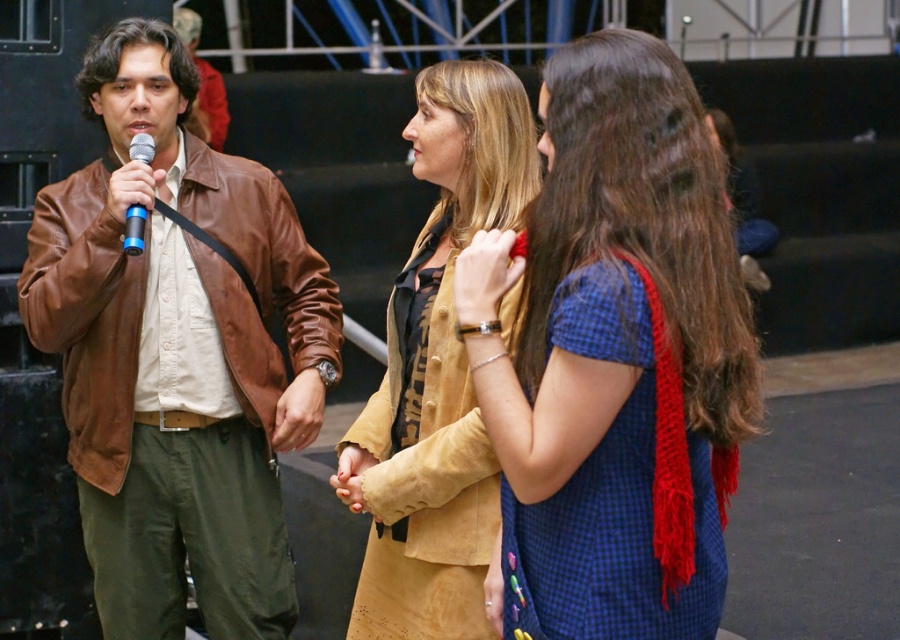
From the picture: You are a photographer who needs to capture a photo of the two jackets, brown leather jacket at left and suede jacket at center, ensuring they are both in focus. Given that your camera can only keep objects within 80 centimeters of each other in focus, will you be able to achieve this?

The brown leather jacket at left and suede jacket at center are 88.34 centimeters apart, which exceeds the camera focus range of 80 centimeters. Therefore, you cannot ensure both jackets are in focus simultaneously.

You are a fashion designer observing the scene. You need to determine which clothing item is shorter between the blue checkered dress at center and the brown leather jacket at left. Which one is shorter?

The blue checkered dress at center is shorter than the brown leather jacket at left according to the description.